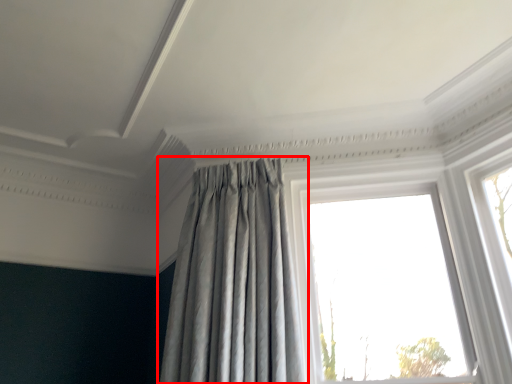
Question: From the image's perspective, what is the correct spatial positioning of curtain (annotated by the red box) in reference to window?

Choices:
 (A) above
 (B) below

Answer: (A)